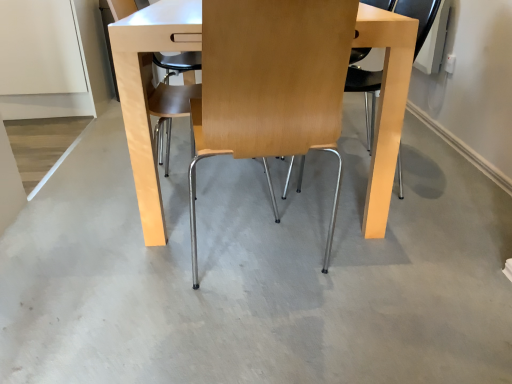
Identify the location of light wood table at center. This screenshot has height=384, width=512. click(258, 108).

Measure the distance between light wood table at center and camera.

light wood table at center and camera are 79.75 centimeters apart.

The image size is (512, 384). What do you see at coordinates (258, 108) in the screenshot? I see `light wood table at center` at bounding box center [258, 108].

The width and height of the screenshot is (512, 384). I want to click on light wood table at center, so click(x=258, y=108).